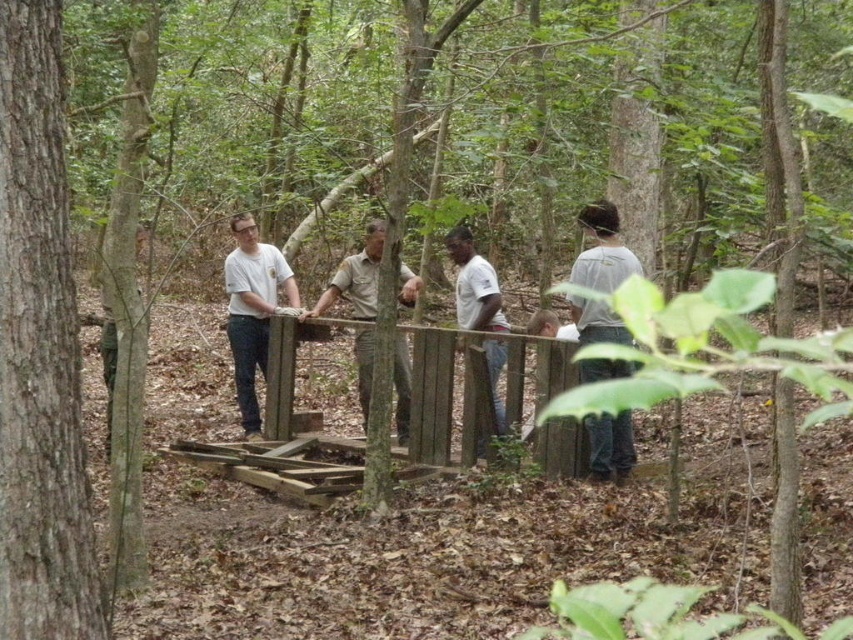
Does gray cotton shirt at center appear over white matte shirt at center?

Indeed, gray cotton shirt at center is positioned over white matte shirt at center.

Between gray cotton shirt at center and white matte shirt at center, which one appears on the left side from the viewer's perspective?

Positioned to the left is white matte shirt at center.

Is point (590, 419) positioned before point (473, 330)?

Yes, it is.

Locate an element on the screen. gray cotton shirt at center is located at coordinates (602, 250).

Which of these two, smooth brown tree trunk at left or white cotton shirt at center, stands taller?

smooth brown tree trunk at left is taller.

Measure the distance between point (59, 449) and camera.

Point (59, 449) and camera are 13.85 feet apart from each other.

Where is `smooth brown tree trunk at left`? The image size is (853, 640). smooth brown tree trunk at left is located at coordinates (39, 349).

Describe the element at coordinates (39, 349) in the screenshot. I see `smooth brown tree trunk at left` at that location.

Does smooth brown tree trunk at left have a lesser width compared to gray cotton shirt at center?

Correct, smooth brown tree trunk at left's width is less than gray cotton shirt at center's.

I want to click on smooth brown tree trunk at left, so click(39, 349).

Where is `smooth brown tree trunk at left`? The height and width of the screenshot is (640, 853). smooth brown tree trunk at left is located at coordinates (39, 349).